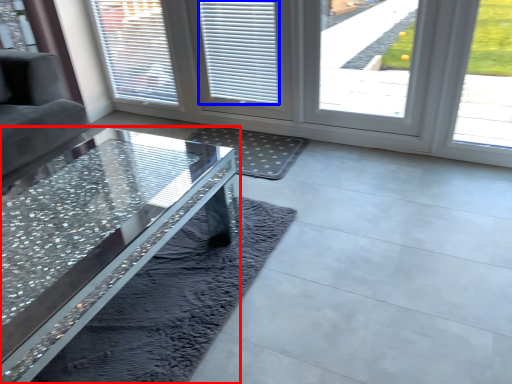
Question: Which object appears farthest to the camera in this image, table (highlighted by a red box) or blind (highlighted by a blue box)?

Choices:
 (A) table
 (B) blind

Answer: (B)